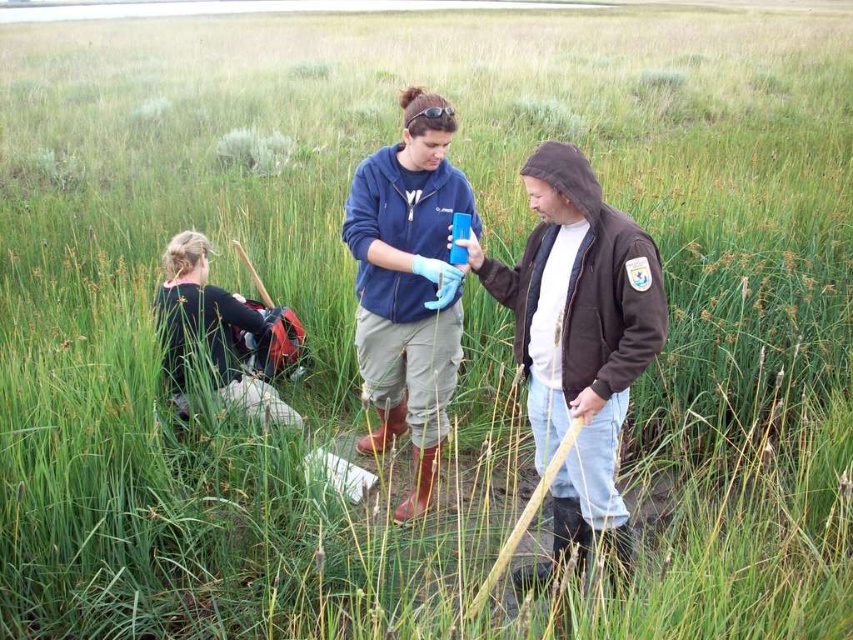
Question: Which is nearer to the blue fabric jacket at center?

Choices:
 (A) dark brown leather jacket at left
 (B) brown leather jacket at center

Answer: (B)

Question: Is blue fabric jacket at center thinner than dark brown leather jacket at left?

Choices:
 (A) yes
 (B) no

Answer: (A)

Question: Which point is closer to the camera taking this photo?

Choices:
 (A) (184, 362)
 (B) (548, 429)
 (C) (399, 426)

Answer: (B)

Question: Which point is farther to the camera?

Choices:
 (A) (561, 362)
 (B) (198, 257)

Answer: (B)

Question: Is blue fabric jacket at center above dark brown leather jacket at left?

Choices:
 (A) yes
 (B) no

Answer: (A)

Question: Can you confirm if brown leather jacket at center is positioned below dark brown leather jacket at left?

Choices:
 (A) no
 (B) yes

Answer: (B)